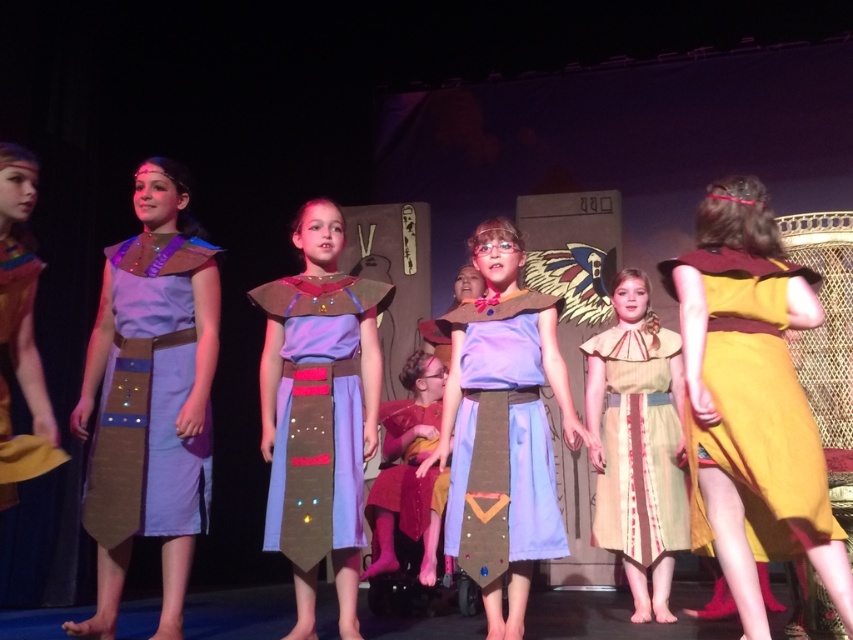
Question: Is matte yellow dress at right positioned at the back of matte purple fabric dress at center?

Choices:
 (A) no
 (B) yes

Answer: (A)

Question: Which point is farther to the camera?

Choices:
 (A) (9, 244)
 (B) (612, 346)
 (C) (431, 403)
 (D) (527, 321)

Answer: (C)

Question: Which object is positioned farthest from the matte purple fabric dress at left?

Choices:
 (A) velvet maroon dress at center
 (B) matte yellow dress at right
 (C) beige fabric dress at center

Answer: (C)

Question: Can you confirm if matte blue fabric dress at center is wider than beige fabric dress at center?

Choices:
 (A) yes
 (B) no

Answer: (B)

Question: Does matte blue fabric dress at center appear on the right side of light purple fabric dress at center?

Choices:
 (A) yes
 (B) no

Answer: (A)

Question: Which point is farther from the camera taking this photo?

Choices:
 (A) click(x=608, y=337)
 (B) click(x=368, y=506)
 (C) click(x=102, y=442)

Answer: (B)